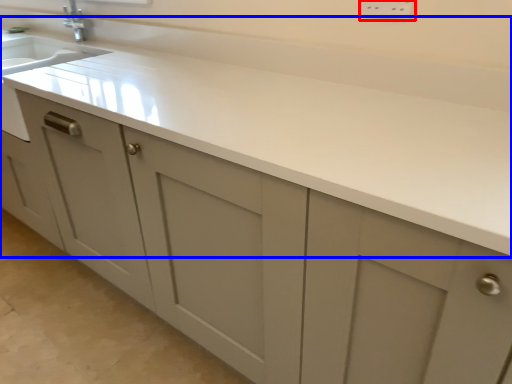
Question: Among these objects, which one is farthest to the camera, electric outlet (highlighted by a red box) or countertop (highlighted by a blue box)?

Choices:
 (A) electric outlet
 (B) countertop

Answer: (A)